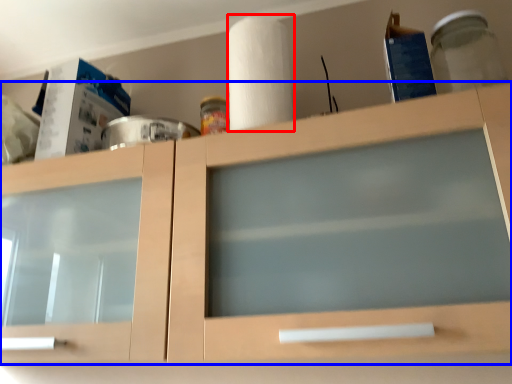
Question: Among these objects, which one is nearest to the camera, paper towel (highlighted by a red box) or cabinetry (highlighted by a blue box)?

Choices:
 (A) paper towel
 (B) cabinetry

Answer: (B)